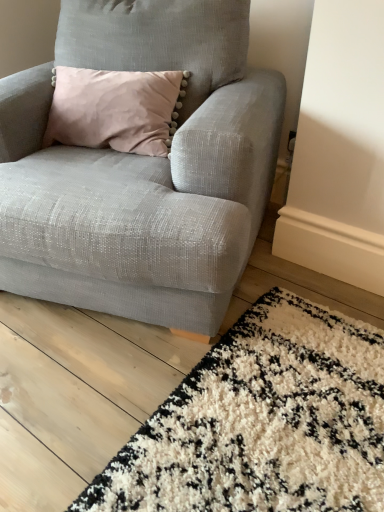
Locate an element on the screen. The height and width of the screenshot is (512, 384). vacant point above white shaggy rug at lower right (from a real-world perspective) is located at coordinates (206, 364).